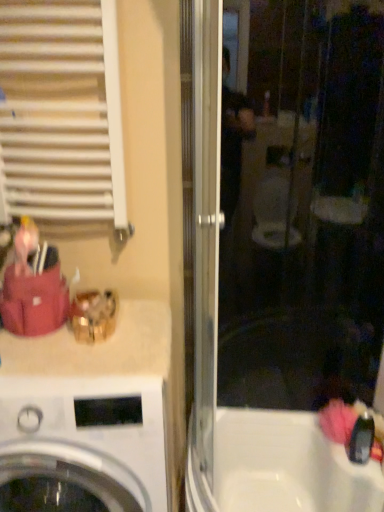
Question: Visually, is white glossy washing machine at lower left positioned to the left or to the right of white glossy bathtub at lower right?

Choices:
 (A) left
 (B) right

Answer: (A)

Question: Considering their positions, is white glossy washing machine at lower left located in front of or behind white glossy bathtub at lower right?

Choices:
 (A) front
 (B) behind

Answer: (A)

Question: Based on their relative distances, which object is nearer to the white glossy washing machine at lower left?

Choices:
 (A) white glossy bathtub at lower right
 (B) transparent glass screen door at center
 (C) white matte radiator at upper left

Answer: (B)

Question: Considering the real-world distances, which object is closest to the white glossy bathtub at lower right?

Choices:
 (A) white matte radiator at upper left
 (B) transparent glass screen door at center
 (C) white glossy washing machine at lower left

Answer: (B)